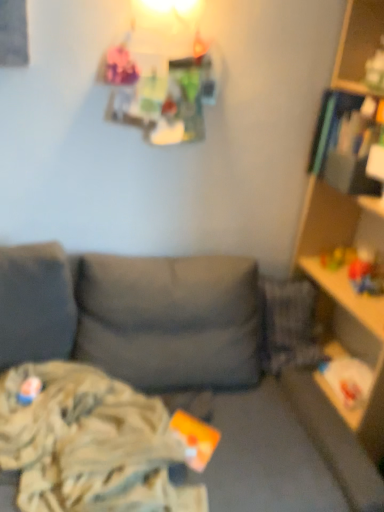
Question: Is camouflage fabric blanket at lower left positioned with its back to matte plastic toy at lower left, which is counted as the 1th toy, starting from the bottom?

Choices:
 (A) no
 (B) yes

Answer: (B)

Question: From a real-world perspective, is camouflage fabric blanket at lower left positioned over matte plastic toy at lower left, which is counted as the 1th toy, starting from the bottom, based on gravity?

Choices:
 (A) yes
 (B) no

Answer: (B)

Question: Considering the relative sizes of camouflage fabric blanket at lower left and matte plastic toy at lower left, acting as the second toy starting from the top, in the image provided, is camouflage fabric blanket at lower left shorter than matte plastic toy at lower left, acting as the second toy starting from the top,?

Choices:
 (A) yes
 (B) no

Answer: (B)

Question: Is camouflage fabric blanket at lower left bigger than matte plastic toy at lower left, acting as the second toy starting from the top?

Choices:
 (A) no
 (B) yes

Answer: (B)

Question: Is camouflage fabric blanket at lower left outside matte plastic toy at lower left, which is the first toy in left-to-right order?

Choices:
 (A) yes
 (B) no

Answer: (A)

Question: Does camouflage fabric blanket at lower left appear on the left side of matte plastic toy at lower left, the 1th toy positioned from the front?

Choices:
 (A) yes
 (B) no

Answer: (B)

Question: From a real-world perspective, is rubberized yellow toy at right, which is counted as the first toy, starting from the right, physically below camouflage fabric blanket at lower left?

Choices:
 (A) yes
 (B) no

Answer: (B)

Question: From a real-world perspective, is rubberized yellow toy at right, the second toy positioned from the front, on top of camouflage fabric blanket at lower left?

Choices:
 (A) yes
 (B) no

Answer: (A)

Question: From the image's perspective, is rubberized yellow toy at right, which is the second toy from bottom to top, on top of camouflage fabric blanket at lower left?

Choices:
 (A) no
 (B) yes

Answer: (B)

Question: Is rubberized yellow toy at right, which is the second toy from bottom to top, to the right of camouflage fabric blanket at lower left from the viewer's perspective?

Choices:
 (A) no
 (B) yes

Answer: (B)

Question: Is camouflage fabric blanket at lower left located within rubberized yellow toy at right, the first toy viewed from the back?

Choices:
 (A) no
 (B) yes

Answer: (A)

Question: Is the depth of rubberized yellow toy at right, the second toy positioned from the front, greater than that of camouflage fabric blanket at lower left?

Choices:
 (A) yes
 (B) no

Answer: (A)

Question: From the image's perspective, does rubberized yellow toy at right, which is the second toy from bottom to top, appear higher than matte plastic toy at lower left, placed as the second toy when sorted from right to left?

Choices:
 (A) yes
 (B) no

Answer: (A)